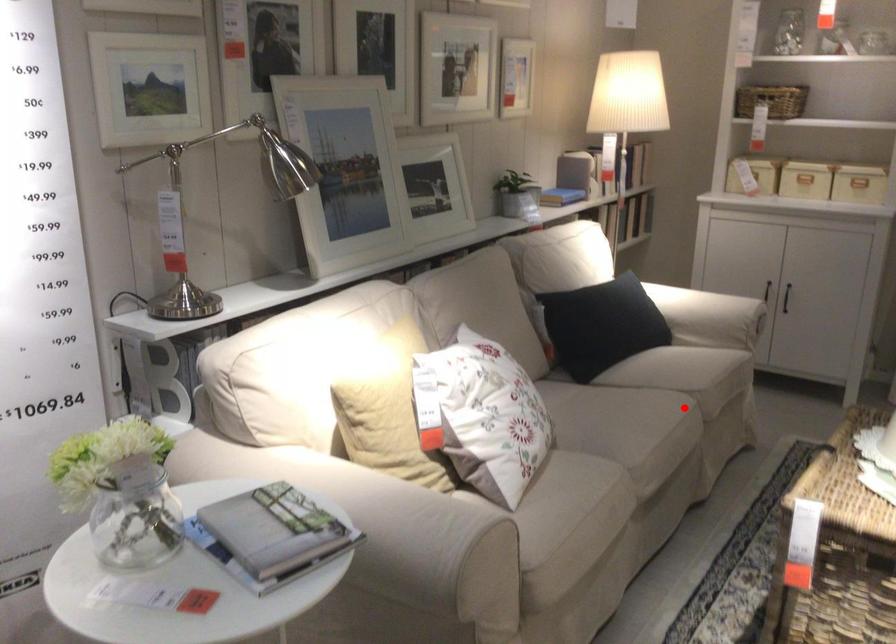
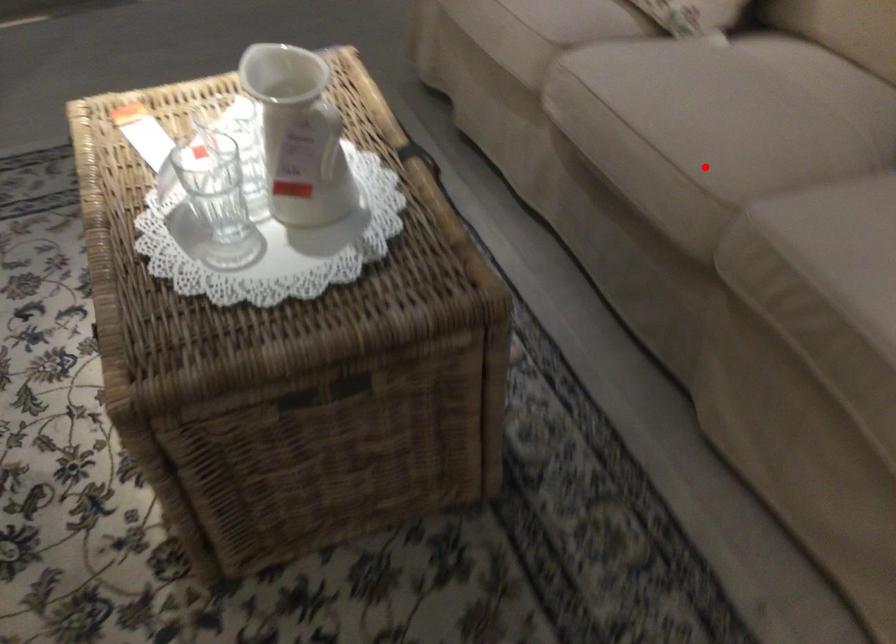
I am providing you with two images of the same scene from different viewpoints. A red point is marked on the first image and another point is marked on the second image. Do the highlighted points in image1 and image2 indicate the same real-world spot?

Yes